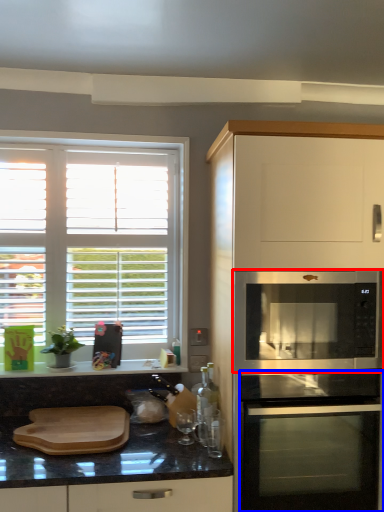
Question: Which object appears farthest to the camera in this image, microwave oven (highlighted by a red box) or oven (highlighted by a blue box)?

Choices:
 (A) microwave oven
 (B) oven

Answer: (A)